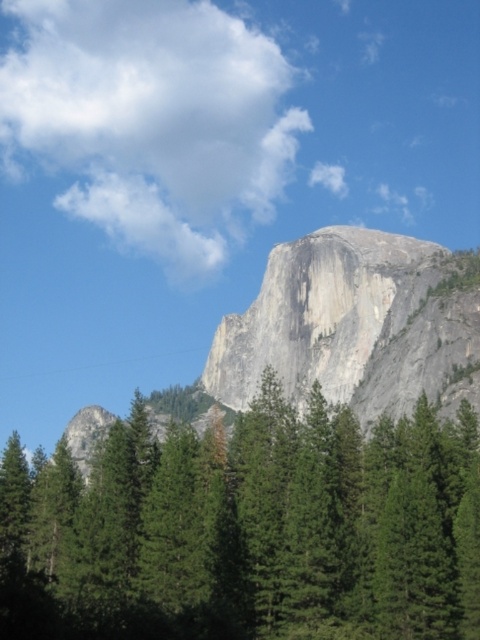
Question: Can you confirm if green matte trees at center is positioned to the right of gray/granite rock formation at center?

Choices:
 (A) yes
 (B) no

Answer: (B)

Question: Is green matte trees at center further to the viewer compared to gray/granite rock formation at center?

Choices:
 (A) no
 (B) yes

Answer: (A)

Question: Which point appears closest to the camera in this image?

Choices:
 (A) (256, 336)
 (B) (171, 522)

Answer: (B)

Question: Is green matte trees at center below gray/granite rock formation at center?

Choices:
 (A) yes
 (B) no

Answer: (A)